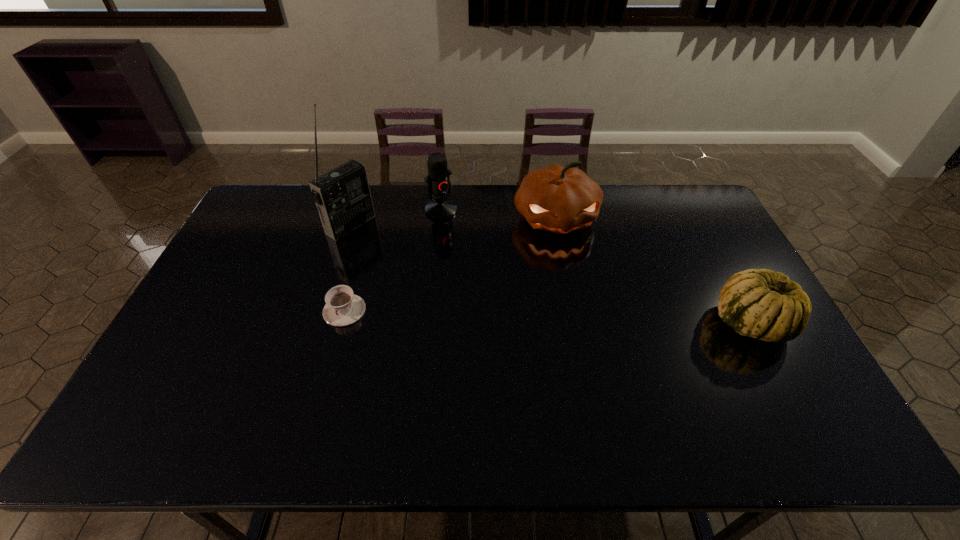
The width and height of the screenshot is (960, 540). I want to click on blank area located 0.100m on the side of the third object from left to right with the red ring, so click(x=463, y=235).

Where is `vacant area situated 0.150m on the front face of the second object from right to left`? Image resolution: width=960 pixels, height=540 pixels. vacant area situated 0.150m on the front face of the second object from right to left is located at coordinates (572, 280).

Locate an element on the screen. The image size is (960, 540). vacant region located on the front face of the second object from right to left is located at coordinates (575, 292).

Find the location of a particular element. free point located on the front face of the second object from right to left is located at coordinates (577, 298).

The height and width of the screenshot is (540, 960). What are the coordinates of `vacant space located 0.200m on the display of the radio receiver` in the screenshot? It's located at (406, 261).

Image resolution: width=960 pixels, height=540 pixels. Find the location of `blank area located 0.170m on the display of the radio receiver`. blank area located 0.170m on the display of the radio receiver is located at coordinates (399, 256).

What are the coordinates of `free space located on the display of the radio receiver` in the screenshot? It's located at (431, 276).

Locate an element on the screen. The height and width of the screenshot is (540, 960). microphone located at the far edge is located at coordinates (438, 180).

I want to click on pumpkin situated at the far edge, so click(559, 199).

I want to click on radio receiver present at the far edge, so click(x=342, y=196).